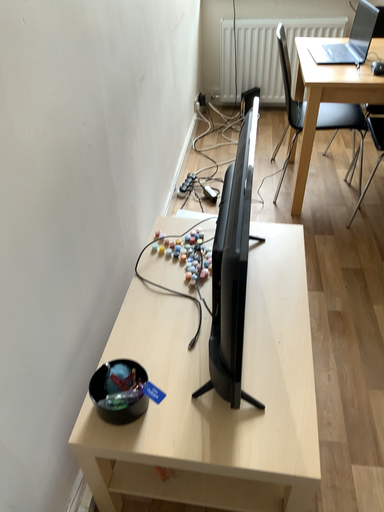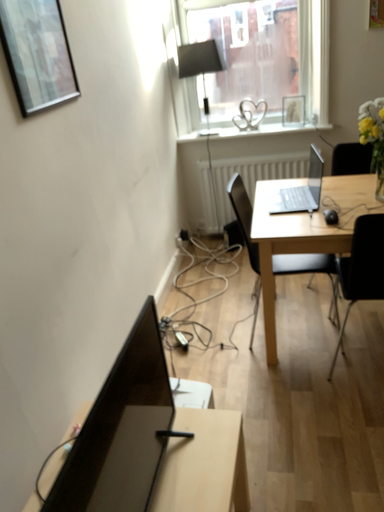
Question: How did the camera likely rotate when shooting the video?

Choices:
 (A) rotated downward
 (B) rotated upward

Answer: (B)